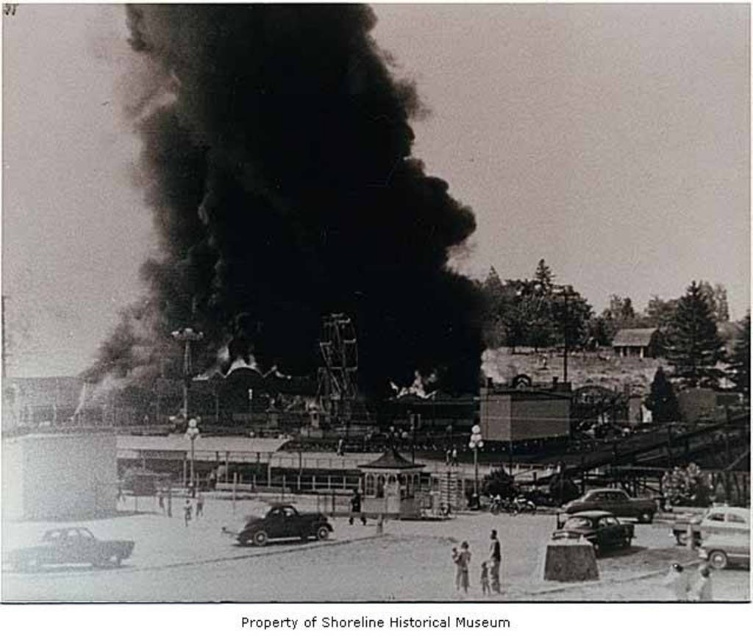
Question: Which object is farther from the camera taking this photo?

Choices:
 (A) shiny chrome sedan at center
 (B) shiny black car at center
 (C) shiny black car at lower left
 (D) shiny silver car at center

Answer: (A)

Question: Does shiny black car at center appear on the left side of shiny silver car at center?

Choices:
 (A) yes
 (B) no

Answer: (A)

Question: Which of the following is the farthest from the observer?

Choices:
 (A) shiny black car at lower left
 (B) shiny chrome sedan at center
 (C) black smoke at center
 (D) shiny black car at center

Answer: (C)

Question: In this image, where is shiny black car at center located relative to shiny chrome sedan at center?

Choices:
 (A) right
 (B) left

Answer: (B)

Question: Can you confirm if shiny black car at center is positioned to the right of shiny chrome sedan at center?

Choices:
 (A) no
 (B) yes

Answer: (A)

Question: Estimate the real-world distances between objects in this image. Which object is closer to the black smoke at center?

Choices:
 (A) shiny chrome sedan at center
 (B) shiny silver car at center
 (C) shiny black car at center
 (D) shiny black car at lower left

Answer: (C)